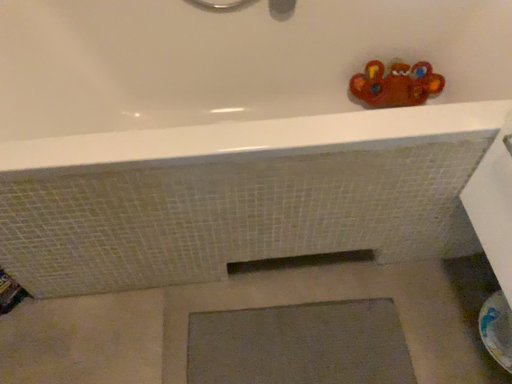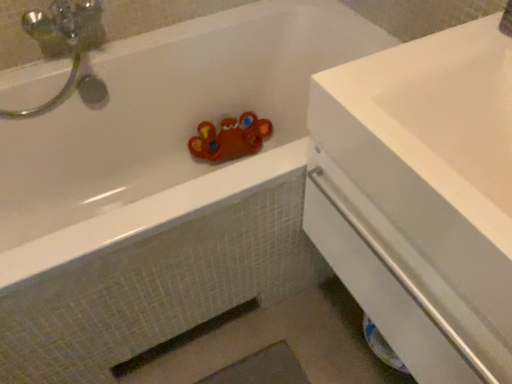
Question: How did the camera likely rotate when shooting the video?

Choices:
 (A) rotated right
 (B) rotated left

Answer: (A)